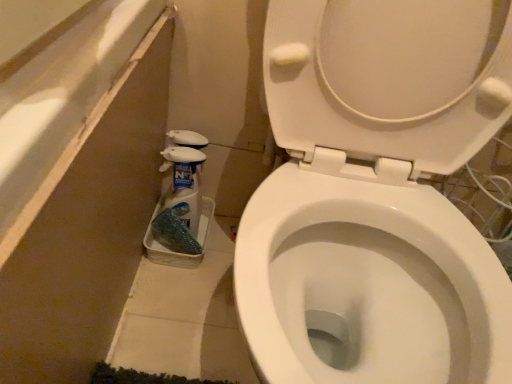
What do you see at coordinates (184, 184) in the screenshot? The image size is (512, 384). I see `translucent plastic bottle at lower left` at bounding box center [184, 184].

Locate an element on the screen. Image resolution: width=512 pixels, height=384 pixels. translucent plastic bottle at lower left is located at coordinates point(184,184).

This screenshot has width=512, height=384. Find the location of `translucent plastic bottle at lower left`. translucent plastic bottle at lower left is located at coordinates tap(184, 184).